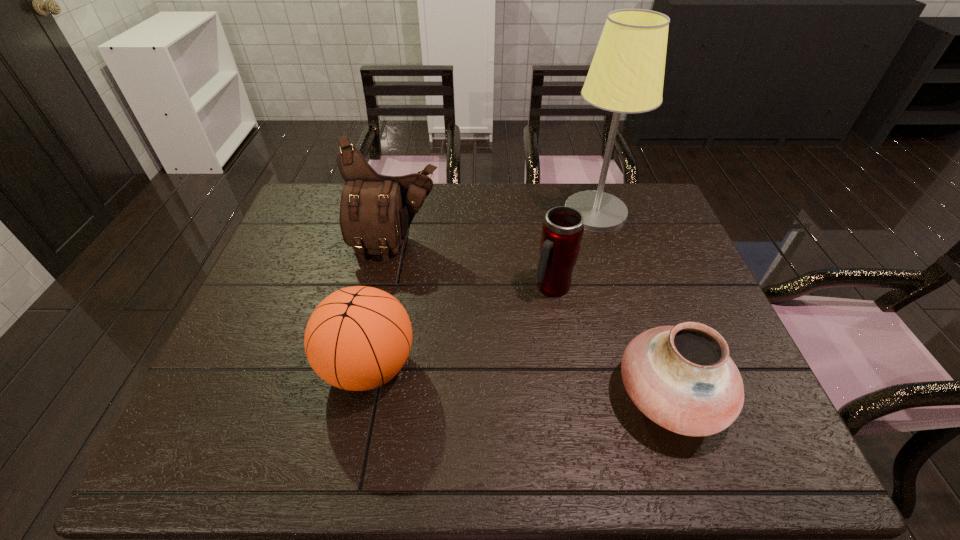
Identify the location of the tallest object. The image size is (960, 540). (x=626, y=75).

What are the coordinates of `the second tallest object` in the screenshot? It's located at (376, 210).

Locate an element on the screen. This screenshot has height=540, width=960. thermos bottle is located at coordinates (562, 231).

At what (x,y) coordinates should I click in order to perform the action: click on the third object from left to right. Please return your answer as a coordinate pair (x, y). The width and height of the screenshot is (960, 540). Looking at the image, I should click on (562, 231).

Locate an element on the screen. Image resolution: width=960 pixels, height=540 pixels. basketball is located at coordinates (x=358, y=338).

Locate an element on the screen. This screenshot has height=540, width=960. pottery is located at coordinates (681, 377).

The image size is (960, 540). What are the coordinates of `vacant point located on the left of the table lamp` in the screenshot? It's located at point(483,213).

The height and width of the screenshot is (540, 960). Find the location of `blank space located 0.200m on the front-facing side of the shoulder bag`. blank space located 0.200m on the front-facing side of the shoulder bag is located at coordinates (380, 316).

The height and width of the screenshot is (540, 960). Find the location of `vacant space situated on the side with the handle of the third object from left to right`. vacant space situated on the side with the handle of the third object from left to right is located at coordinates (560, 336).

I want to click on vacant region located 0.150m on the right of the basketball, so click(481, 366).